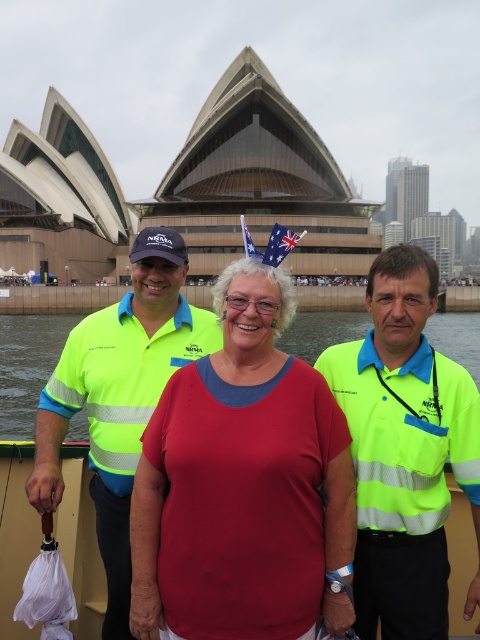
Is red fabric flag at center below blue fabric flag at center?

Indeed, red fabric flag at center is positioned under blue fabric flag at center.

Does red fabric flag at center appear over blue fabric flag at center?

No.

The width and height of the screenshot is (480, 640). Find the location of `red fabric flag at center`. red fabric flag at center is located at coordinates (279, 244).

This screenshot has height=640, width=480. I want to click on red fabric flag at center, so click(279, 244).

Who is more forward, (155, 442) or (151, 257)?

Point (155, 442)

Which is above, red matte shirt at center or matte yellow uniform at center?

matte yellow uniform at center

Consider the image. Who is more distant from viewer, (300, 596) or (131, 472)?

The point (131, 472) is behind.

This screenshot has width=480, height=640. In order to click on red matte shirt at center in this screenshot , I will do `click(242, 484)`.

This screenshot has width=480, height=640. Describe the element at coordinates (242, 484) in the screenshot. I see `red matte shirt at center` at that location.

Does red matte shirt at center lie behind neon yellow reflective shirt at center?

No.

Is point (156, 536) positioned before point (153, 284)?

Yes, it is.

Locate an element on the screen. Image resolution: width=480 pixels, height=640 pixels. red matte shirt at center is located at coordinates (242, 484).